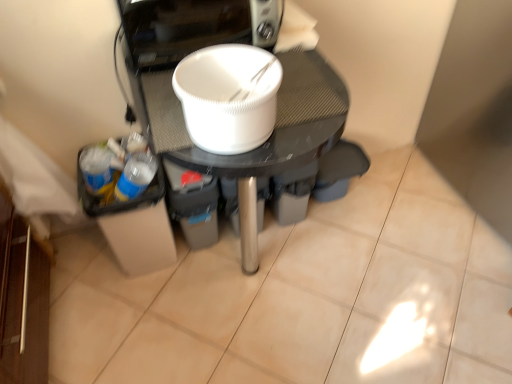
At what (x,y) coordinates should I click in order to perform the action: click on free spot to the left of white matte bowl at center. Please return your answer as a coordinate pair (x, y). Looking at the image, I should click on (117, 312).